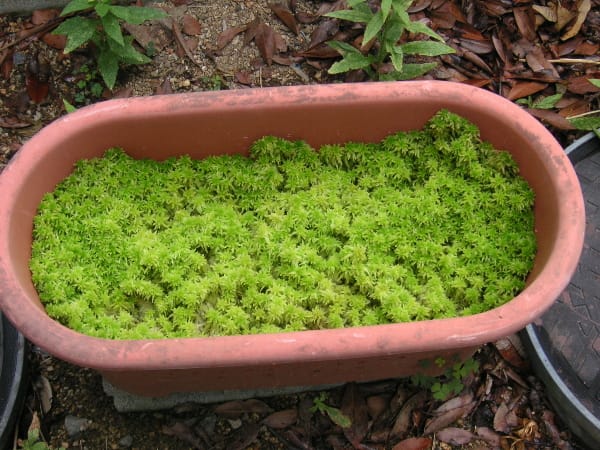
The width and height of the screenshot is (600, 450). What are the coordinates of `covers` in the screenshot? It's located at (437, 387).